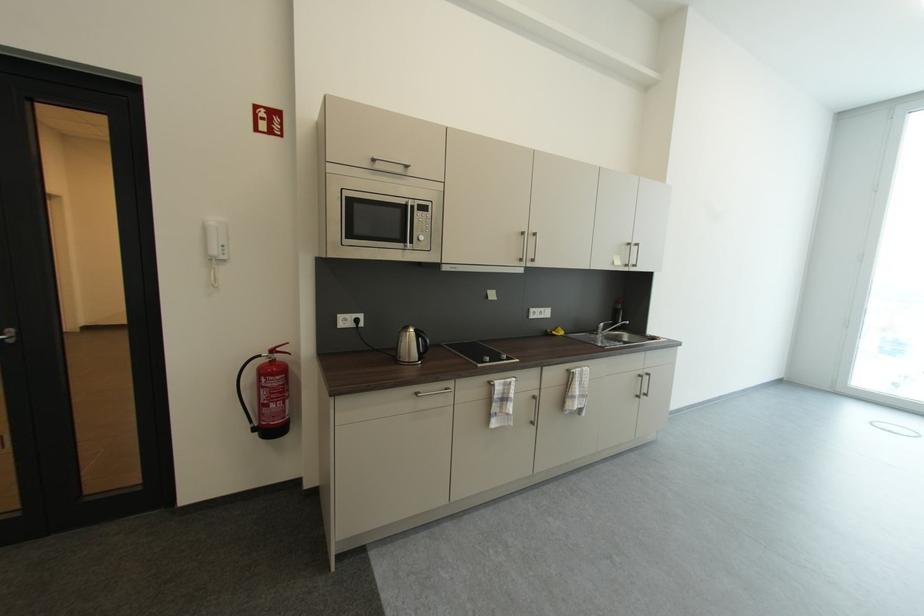
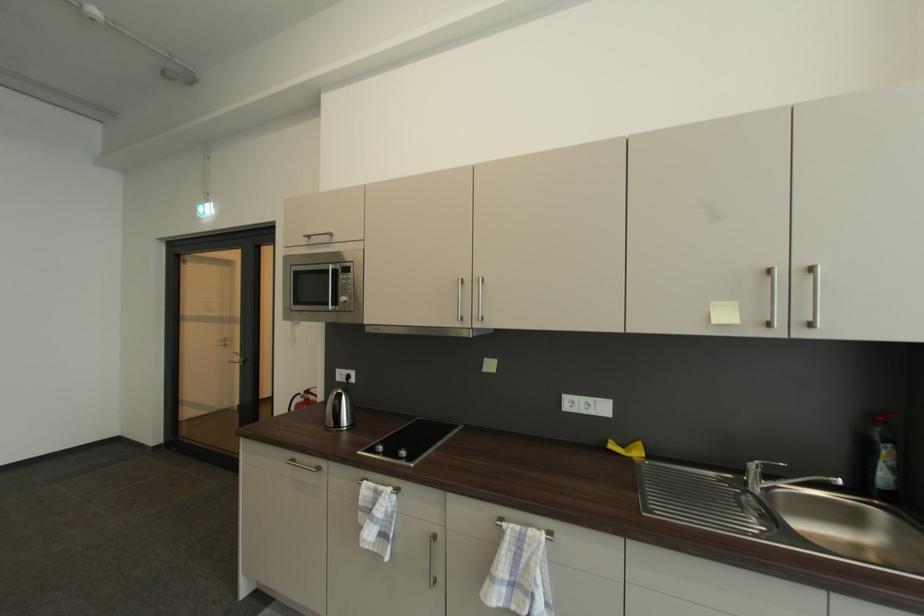
The point at (x=579, y=373) is marked in the first image. Where is the corresponding point in the second image?

(507, 529)